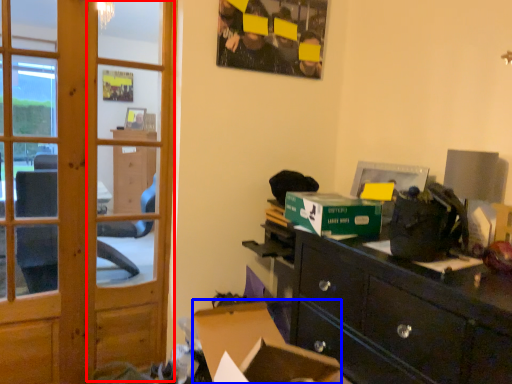
Question: Which object appears farthest to the camera in this image, screen door (highlighted by a red box) or computer desk (highlighted by a blue box)?

Choices:
 (A) screen door
 (B) computer desk

Answer: (A)